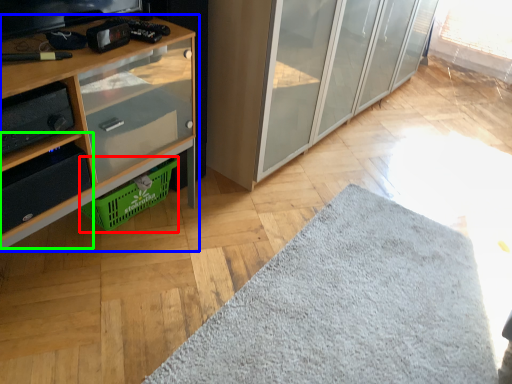
Question: Based on their relative distances, which object is farther from basket (highlighted by a red box)? Choose from cupboard (highlighted by a blue box) and shelf (highlighted by a green box).

Choices:
 (A) cupboard
 (B) shelf

Answer: (B)